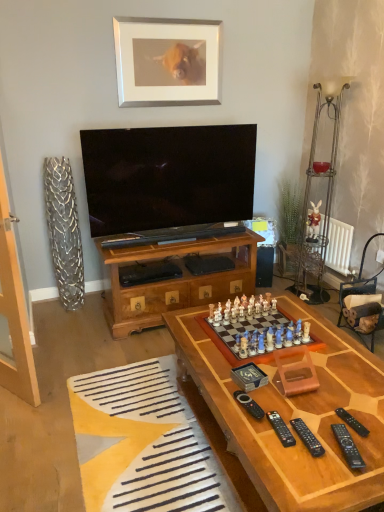
Where is `free space in front of wooden chess set at center`? The height and width of the screenshot is (512, 384). free space in front of wooden chess set at center is located at coordinates (301, 392).